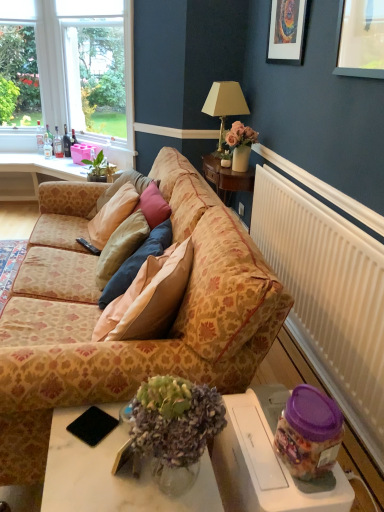
Find the location of a particular element. The width and height of the screenshot is (384, 512). free space above purple plastic jar at lower right (from a real-world perspective) is located at coordinates (273, 432).